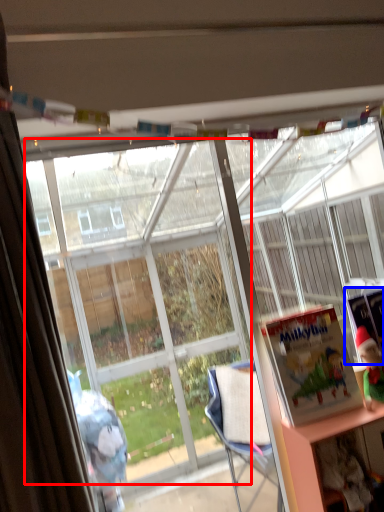
Question: Among these objects, which one is nearest to the camera, bay window (highlighted by a red box) or book (highlighted by a blue box)?

Choices:
 (A) bay window
 (B) book

Answer: (A)